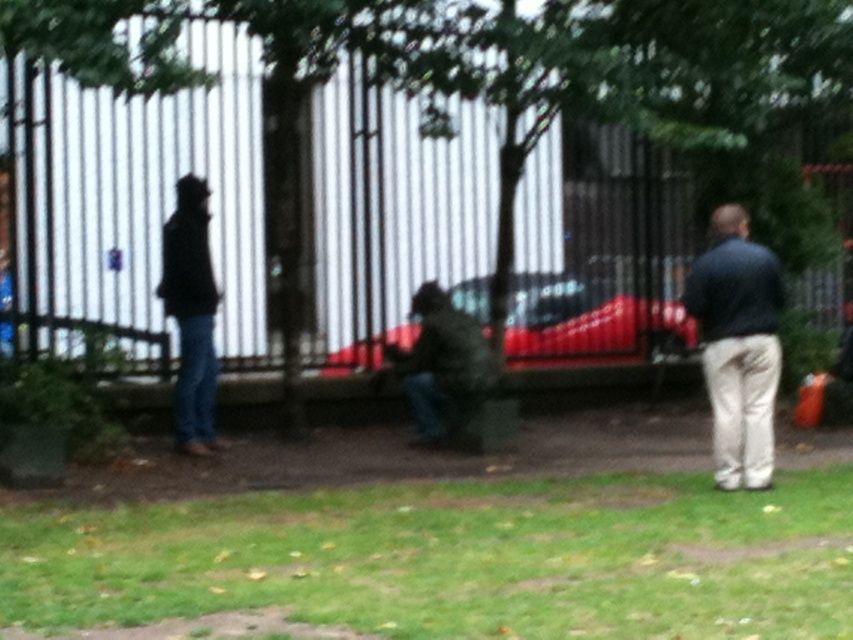
Is point (741, 317) positioned after point (534, 330)?

No, it is not.

In the scene shown: Who is more forward, (691, 294) or (524, 349)?

Point (691, 294) is more forward.

Does point (720, 314) come closer to viewer compared to point (511, 321)?

Yes.

Identify the location of dark blue jeans at right. click(x=738, y=346).

Is shiny red car at center to the right of camouflage fabric jacket at center from the viewer's perspective?

Indeed, shiny red car at center is positioned on the right side of camouflage fabric jacket at center.

Does shiny red car at center have a smaller size compared to camouflage fabric jacket at center?

Incorrect, shiny red car at center is not smaller in size than camouflage fabric jacket at center.

Does point (363, 340) lie behind point (374, 384)?

Yes, point (363, 340) is behind point (374, 384).

Where is `shiny red car at center`? The height and width of the screenshot is (640, 853). shiny red car at center is located at coordinates (589, 323).

Between point (762, 308) and point (190, 394), which one is positioned in front?

Point (762, 308) is in front.

Between dark blue jeans at right and black matte jacket at left, which one is positioned higher?

black matte jacket at left

Which is in front, point (762, 435) or point (200, 413)?

Positioned in front is point (762, 435).

Find the location of `dark blue jeans at right`. dark blue jeans at right is located at coordinates (738, 346).